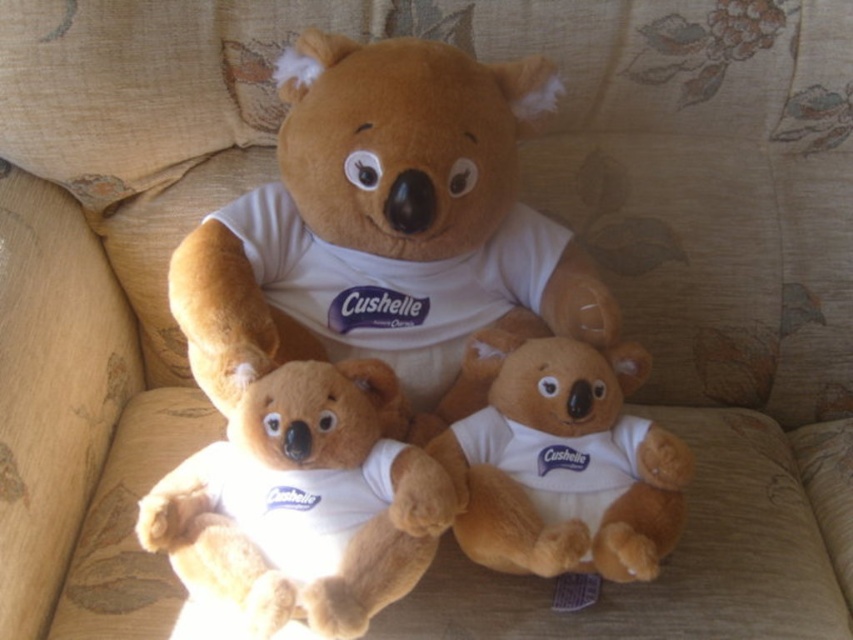
Question: Does soft plush bear at center appear on the left side of soft plush teddy bear at center?

Choices:
 (A) no
 (B) yes

Answer: (B)

Question: Is white soft t-shirt at center wider than soft plush bear at center?

Choices:
 (A) yes
 (B) no

Answer: (A)

Question: Which point is closer to the camera taking this photo?

Choices:
 (A) (399, 67)
 (B) (520, 460)

Answer: (A)

Question: Can you confirm if white soft t-shirt at center is positioned above soft plush bear at center?

Choices:
 (A) no
 (B) yes

Answer: (B)

Question: Which point is closer to the camera?

Choices:
 (A) (549, 483)
 (B) (399, 120)

Answer: (B)

Question: Which point is closer to the camera?

Choices:
 (A) white soft t-shirt at center
 (B) soft plush bear at center

Answer: (B)